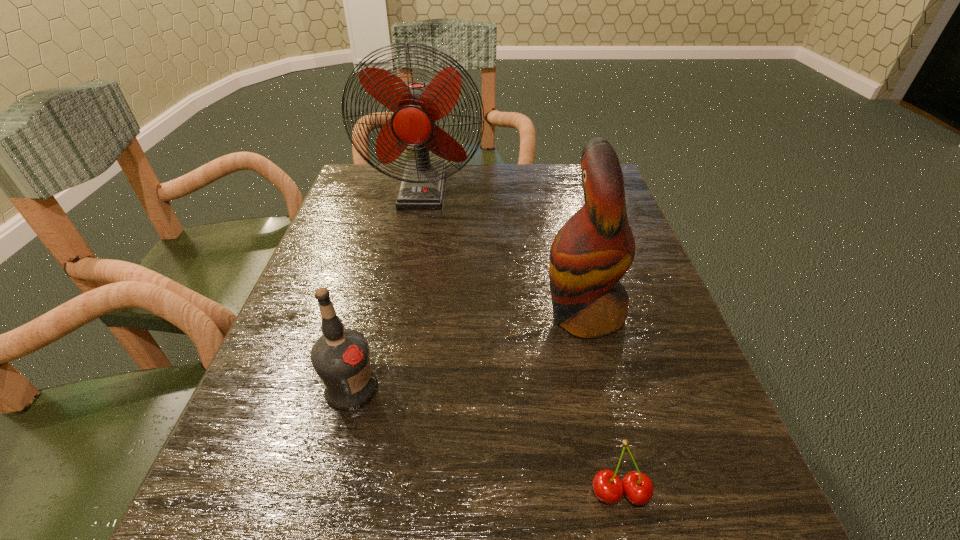
At what (x,y) coordinates should I click in order to perform the action: click on the farthest object. Please return your answer as a coordinate pair (x, y). This screenshot has height=540, width=960. Looking at the image, I should click on (416, 106).

Where is `the third nearest object`? This screenshot has width=960, height=540. the third nearest object is located at coordinates coord(593,250).

Where is `the third farthest object`? the third farthest object is located at coordinates (340, 357).

Image resolution: width=960 pixels, height=540 pixels. What are the coordinates of `vodka` in the screenshot? It's located at (340, 357).

Locate an element on the screen. The image size is (960, 540). the shortest object is located at coordinates (638, 488).

Where is `cherry`? cherry is located at coordinates (638, 488).

The height and width of the screenshot is (540, 960). What are the coordinates of `free space located on the front-facing side of the fan` in the screenshot? It's located at (399, 312).

What are the coordinates of `vacant region located on the face of the third nearest object` in the screenshot? It's located at (351, 314).

The width and height of the screenshot is (960, 540). I want to click on free location located on the face of the third nearest object, so click(422, 314).

Identify the location of vacant space located on the face of the third nearest object. The height and width of the screenshot is (540, 960). (422, 314).